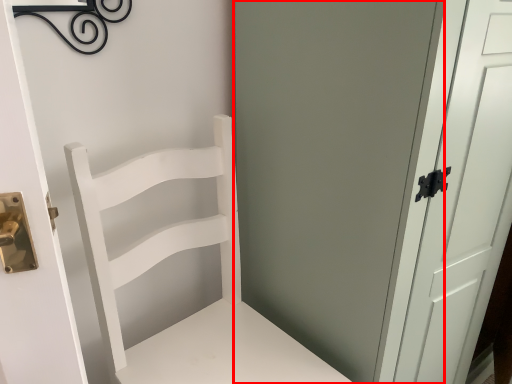
Question: Observing the image, what is the correct spatial positioning of screen door (annotated by the red box) in reference to chair?

Choices:
 (A) right
 (B) left

Answer: (A)